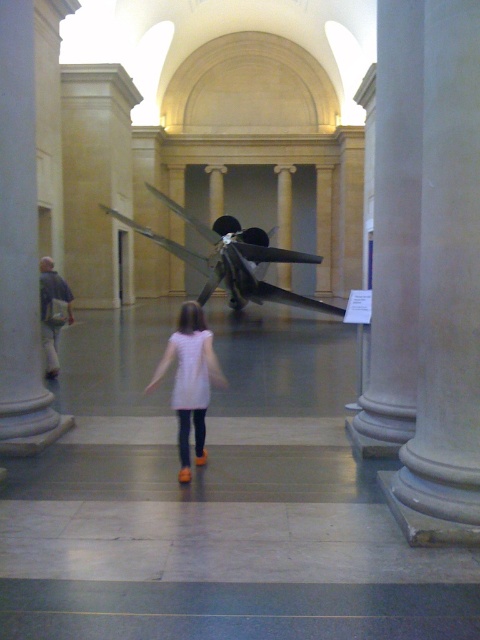
Question: Which of the following is the farthest from the observer?

Choices:
 (A) shiny metallic propeller at center
 (B) white marble pillar at left
 (C) pink fabric dress at center
 (D) white marble pillar at center

Answer: (A)

Question: From the image, what is the correct spatial relationship of white marble pillar at center in relation to shiny metallic propeller at center?

Choices:
 (A) right
 (B) left

Answer: (A)

Question: Does smooth gray pillar at right appear on the right side of pink fabric dress at center?

Choices:
 (A) yes
 (B) no

Answer: (A)

Question: Is smooth gray pillar at right to the right of white marble pillar at left from the viewer's perspective?

Choices:
 (A) yes
 (B) no

Answer: (A)

Question: Among these objects, which one is farthest from the camera?

Choices:
 (A) smooth gray pillar at right
 (B) pink fabric dress at center
 (C) white marble pillar at left

Answer: (C)

Question: Which point is farther from the camera taking this photo?

Choices:
 (A) (193, 371)
 (B) (13, 144)
 (C) (477, 138)
 (D) (335, 314)

Answer: (D)